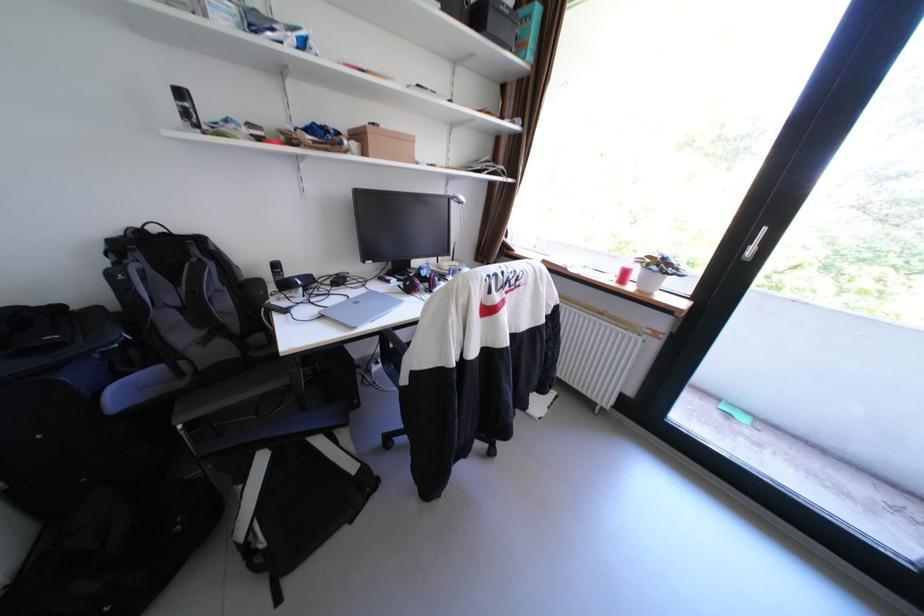
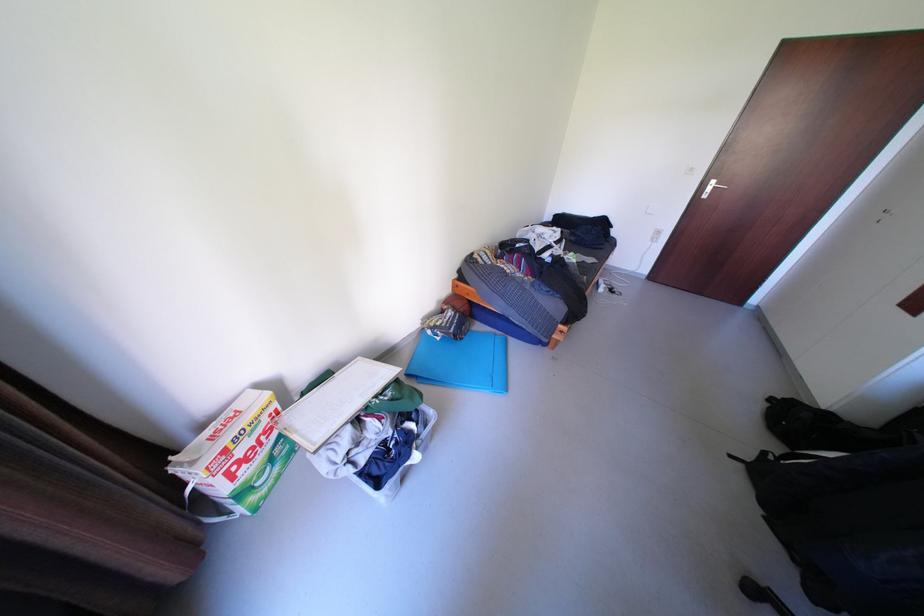
The point at (298, 581) is marked in the first image. Where is the corresponding point in the second image?

(752, 466)